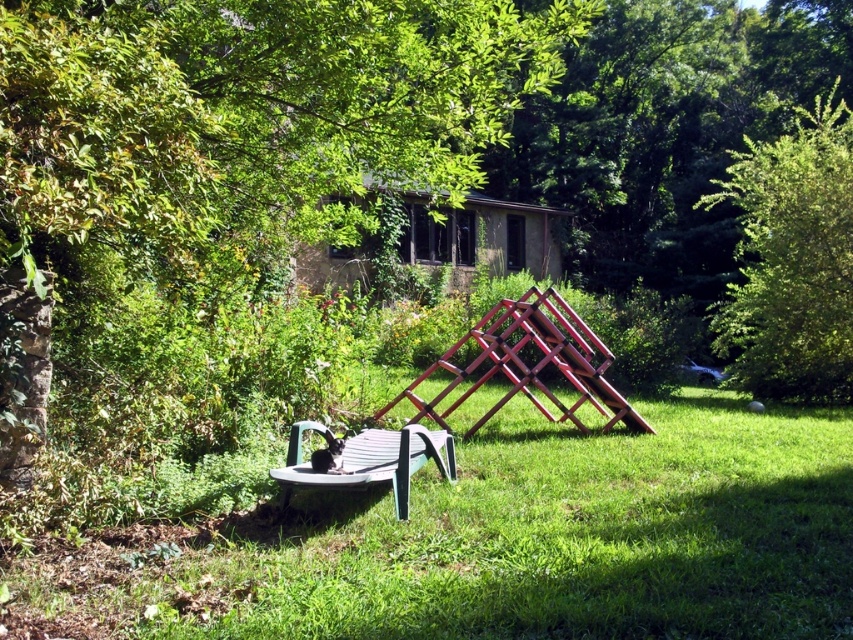
Consider the image. Can you confirm if green leafy tree at upper right is positioned to the right of green plastic park bench at lower left?

Yes, green leafy tree at upper right is to the right of green plastic park bench at lower left.

Which is above, green leafy tree at upper right or green plastic park bench at lower left?

green leafy tree at upper right is higher up.

What are the coordinates of `green leafy tree at upper right` in the screenshot? It's located at (792, 259).

Who is higher up, green leafy tree at center or green plastic park bench at lower left?

green leafy tree at center

Is point (148, 179) positioned in front of point (396, 452)?

Yes, it is in front of point (396, 452).

The image size is (853, 640). Identify the location of green leafy tree at center. (248, 120).

Does wooden chair at center lie behind green plastic park bench at lower left?

Yes, it is behind green plastic park bench at lower left.

Who is more distant from viewer, (x=561, y=374) or (x=451, y=474)?

Point (x=561, y=374)

Identify the location of wooden chair at center. Image resolution: width=853 pixels, height=640 pixels. (531, 362).